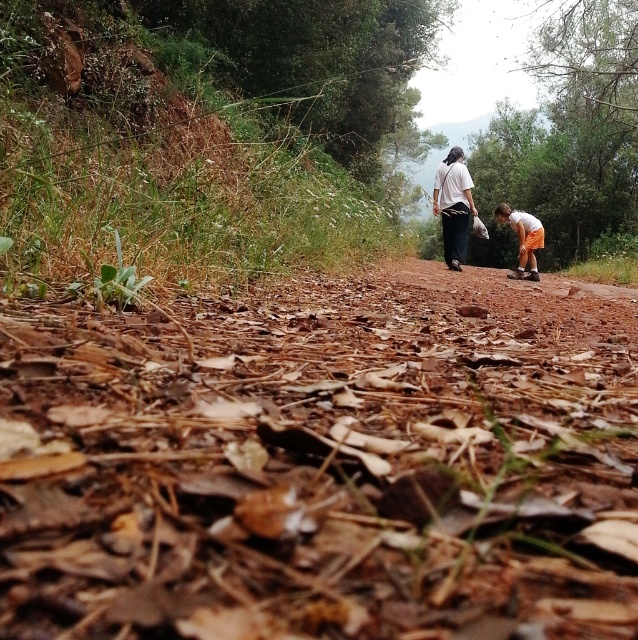
Question: From the image, what is the correct spatial relationship of brown dry leaves at center in relation to orange cotton shorts at lower right?

Choices:
 (A) below
 (B) above

Answer: (A)

Question: Is brown dry leaves at center to the left of white cotton shirt at upper center from the viewer's perspective?

Choices:
 (A) no
 (B) yes

Answer: (B)

Question: Can you confirm if white cotton shirt at upper center is wider than orange cotton shorts at lower right?

Choices:
 (A) no
 (B) yes

Answer: (A)

Question: Which object is positioned closest to the orange cotton shorts at lower right?

Choices:
 (A) white cotton shirt at upper center
 (B) brown dry leaves at center

Answer: (A)

Question: Which point is closer to the camera taking this photo?

Choices:
 (A) (494, 212)
 (B) (609, 614)
 (C) (464, 211)

Answer: (B)

Question: Which point is closer to the camera?

Choices:
 (A) (10, 593)
 (B) (454, 230)

Answer: (A)